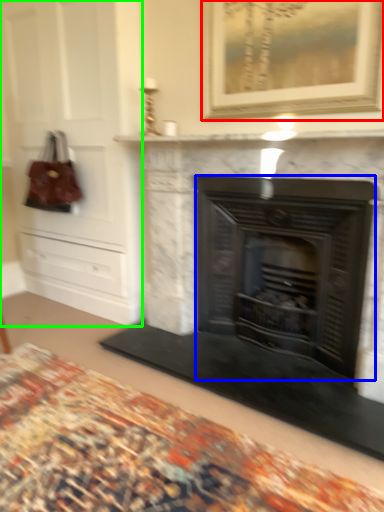
Question: Which is farther away from picture frame (highlighted by a red box)? fireplace (highlighted by a blue box) or dresser (highlighted by a green box)?

Choices:
 (A) fireplace
 (B) dresser

Answer: (B)